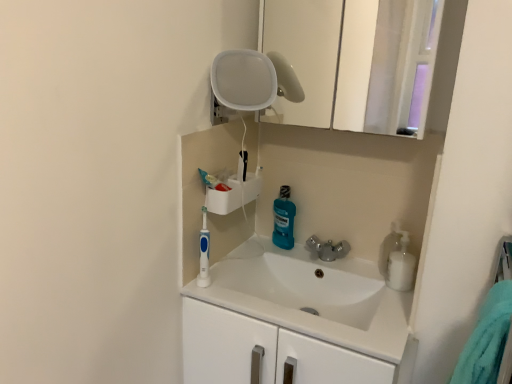
What is the approximate height of blue glossy mouthwash at center, which is the 2th cleaning product in front-to-back order?

It is 22.59 centimeters.

What do you see at coordinates (401, 265) in the screenshot? I see `white glossy bottle at right, the 1th cleaning product from the right` at bounding box center [401, 265].

What do you see at coordinates (313, 297) in the screenshot? This screenshot has height=384, width=512. I see `white glossy sink at center` at bounding box center [313, 297].

Locate an element on the screen. blue glossy mouthwash at center, acting as the 1th cleaning product starting from the back is located at coordinates (284, 219).

Considering the relative positions of white glossy medicine cabinet at upper center and blue glossy mouthwash at center, which is the 2th cleaning product in front-to-back order, in the image provided, is white glossy medicine cabinet at upper center behind blue glossy mouthwash at center, which is the 2th cleaning product in front-to-back order,?

No, the depth of white glossy medicine cabinet at upper center is less than that of blue glossy mouthwash at center, which is the 2th cleaning product in front-to-back order.

Does white glossy medicine cabinet at upper center turn towards blue glossy mouthwash at center, positioned as the second cleaning product in right-to-left order?

No, white glossy medicine cabinet at upper center is not aimed at blue glossy mouthwash at center, positioned as the second cleaning product in right-to-left order.

Looking at this image, is blue glossy mouthwash at center, which is the 2th cleaning product in front-to-back order, completely or partially inside white glossy medicine cabinet at upper center?

No, blue glossy mouthwash at center, which is the 2th cleaning product in front-to-back order, is not surrounded by white glossy medicine cabinet at upper center.

Considering the sizes of teal soft towel at right and blue glossy mouthwash at center, positioned as the second cleaning product in right-to-left order, in the image, is teal soft towel at right bigger or smaller than blue glossy mouthwash at center, positioned as the second cleaning product in right-to-left order,?

teal soft towel at right is bigger than blue glossy mouthwash at center, positioned as the second cleaning product in right-to-left order.

Based on the photo, from a real-world perspective, does teal soft towel at right sit lower than blue glossy mouthwash at center, marked as the 1th cleaning product in a left-to-right arrangement?

Actually, teal soft towel at right is physically above blue glossy mouthwash at center, marked as the 1th cleaning product in a left-to-right arrangement, in the real world.

Is teal soft towel at right facing away from blue glossy mouthwash at center, acting as the 1th cleaning product starting from the back?

No, teal soft towel at right's orientation is not away from blue glossy mouthwash at center, acting as the 1th cleaning product starting from the back.

Looking at this image, is teal soft towel at right in front of or behind blue glossy mouthwash at center, acting as the 1th cleaning product starting from the back, in the image?

Clearly, teal soft towel at right is in front of blue glossy mouthwash at center, acting as the 1th cleaning product starting from the back.

From a real-world perspective, is teal soft towel at right located beneath white glossy sink at center?

No, from a real-world perspective, teal soft towel at right is not under white glossy sink at center.

How much distance is there between teal soft towel at right and white glossy sink at center?

teal soft towel at right is 22.76 inches from white glossy sink at center.

Is point (488, 297) in front of point (334, 289)?

Yes, point (488, 297) is closer to viewer.

In the scene shown: Choose the correct answer: Is teal soft towel at right inside white glossy sink at center or outside it?

teal soft towel at right is located beyond the bounds of white glossy sink at center.

Looking at this image, is white glossy bottle at right, the 1th cleaning product from the right, outside of blue plastic toothbrush at center-left?

→ white glossy bottle at right, the 1th cleaning product from the right, lies outside blue plastic toothbrush at center-left's area.

Does white glossy bottle at right, which is the second cleaning product in back-to-front order, have a lesser height compared to blue plastic toothbrush at center-left?

Indeed, white glossy bottle at right, which is the second cleaning product in back-to-front order, has a lesser height compared to blue plastic toothbrush at center-left.

Is white glossy bottle at right, the 1th cleaning product positioned from the front, facing towards blue plastic toothbrush at center-left?

No, white glossy bottle at right, the 1th cleaning product positioned from the front, is not turned towards blue plastic toothbrush at center-left.

Can you see white glossy bottle at right, the 1th cleaning product positioned from the front, touching blue plastic toothbrush at center-left?

Answer: They are not placed beside each other.

From a real-world perspective, is white glossy medicine cabinet at upper center above or below blue plastic toothbrush at center-left?

In terms of real-world spatial position, white glossy medicine cabinet at upper center is above blue plastic toothbrush at center-left.

Which is behind, point (398, 43) or point (203, 227)?

Positioned behind is point (398, 43).

Can you confirm if white glossy medicine cabinet at upper center is taller than blue plastic toothbrush at center-left?

Yes, white glossy medicine cabinet at upper center is taller than blue plastic toothbrush at center-left.

Does white glossy medicine cabinet at upper center turn towards blue plastic toothbrush at center-left?

No.

Considering the relative sizes of white glossy medicine cabinet at upper center and white glossy bottle at right, which is the second cleaning product in back-to-front order, in the image provided, is white glossy medicine cabinet at upper center bigger than white glossy bottle at right, which is the second cleaning product in back-to-front order,?

Indeed, white glossy medicine cabinet at upper center has a larger size compared to white glossy bottle at right, which is the second cleaning product in back-to-front order.

From a real-world perspective, between white glossy medicine cabinet at upper center and white glossy bottle at right, the 2th cleaning product positioned from the left, who is vertically higher?

white glossy medicine cabinet at upper center, from a real-world perspective.

Considering the relative sizes of white glossy medicine cabinet at upper center and white glossy bottle at right, the 1th cleaning product positioned from the front, in the image provided, is white glossy medicine cabinet at upper center shorter than white glossy bottle at right, the 1th cleaning product positioned from the front,?

In fact, white glossy medicine cabinet at upper center may be taller than white glossy bottle at right, the 1th cleaning product positioned from the front.

Is blue plastic toothbrush at center-left outside of white glossy medicine cabinet at upper center?

That's correct, blue plastic toothbrush at center-left is outside of white glossy medicine cabinet at upper center.

Considering the relative positions of blue plastic toothbrush at center-left and white glossy medicine cabinet at upper center in the image provided, is blue plastic toothbrush at center-left to the left of white glossy medicine cabinet at upper center from the viewer's perspective?

Indeed, blue plastic toothbrush at center-left is positioned on the left side of white glossy medicine cabinet at upper center.

In terms of height, does blue plastic toothbrush at center-left look taller or shorter compared to white glossy medicine cabinet at upper center?

Clearly, blue plastic toothbrush at center-left is shorter compared to white glossy medicine cabinet at upper center.

Which object is further away from the camera taking this photo, blue plastic toothbrush at center-left or white glossy medicine cabinet at upper center?

blue plastic toothbrush at center-left is behind.

There is a white glossy medicine cabinet at upper center. At what (x,y) coordinates should I click in order to perform the action: click on the 1st cleaning product below it (from a real-world perspective). Please return your answer as a coordinate pair (x, y). This screenshot has height=384, width=512. Looking at the image, I should click on (284, 219).

Identify the location of bath towel that appears below the blue glossy mouthwash at center, positioned as the second cleaning product in right-to-left order (from the image's perspective). [x=486, y=339].

When comparing their distances from white glossy bottle at right, the 1th cleaning product from the right, does white glossy sink at center or teal soft towel at right seem closer?

white glossy sink at center is positioned closer to the anchor white glossy bottle at right, the 1th cleaning product from the right.

When comparing their distances from teal soft towel at right, does blue glossy mouthwash at center, which is the 2th cleaning product in front-to-back order, or white glossy sink at center seem further?

Among the two, blue glossy mouthwash at center, which is the 2th cleaning product in front-to-back order, is located further to teal soft towel at right.

Based on their spatial positions, is white glossy medicine cabinet at upper center or white glossy sink at center closer to blue plastic toothbrush at center-left?

white glossy sink at center is closer to blue plastic toothbrush at center-left.

When comparing their distances from blue plastic toothbrush at center-left, does blue glossy mouthwash at center, marked as the 1th cleaning product in a left-to-right arrangement, or white glossy bottle at right, which is the second cleaning product in back-to-front order, seem closer?

The object closer to blue plastic toothbrush at center-left is blue glossy mouthwash at center, marked as the 1th cleaning product in a left-to-right arrangement.

Looking at the image, which one is located closer to blue plastic toothbrush at center-left, teal soft towel at right or white glossy sink at center?

white glossy sink at center lies closer to blue plastic toothbrush at center-left than the other object.

When comparing their distances from teal soft towel at right, does blue plastic toothbrush at center-left or white glossy bottle at right, which is the second cleaning product in back-to-front order, seem closer?

white glossy bottle at right, which is the second cleaning product in back-to-front order.

Based on their spatial positions, is blue plastic toothbrush at center-left or white glossy bottle at right, the 1th cleaning product positioned from the front, closer to white glossy medicine cabinet at upper center?

white glossy bottle at right, the 1th cleaning product positioned from the front, lies closer to white glossy medicine cabinet at upper center than the other object.

Estimate the real-world distances between objects in this image. Which object is further from teal soft towel at right, white glossy sink at center or white glossy bottle at right, the 2th cleaning product positioned from the left?

white glossy sink at center.

You are a GUI agent. You are given a task and a screenshot of the screen. Output one action in this format:
    pyautogui.click(x=<x>, y=<y>)
    Task: Click on the toiletry between blue glossy mouthwash at center, marked as the 1th cleaning product in a left-to-right arrangement, and white glossy sink at center, in the vertical direction
    Image resolution: width=512 pixels, height=384 pixels.
    Given the screenshot: What is the action you would take?
    pyautogui.click(x=204, y=253)

Image resolution: width=512 pixels, height=384 pixels. What are the coordinates of `toiletry located between teal soft towel at right and blue glossy mouthwash at center, which is the 2th cleaning product in front-to-back order, in the depth direction` in the screenshot? It's located at (204, 253).

In order to click on toiletry between white glossy medicine cabinet at upper center and white glossy bottle at right, which is the second cleaning product in back-to-front order, in the up-down direction in this screenshot , I will do `click(204, 253)`.

At what (x,y) coordinates should I click in order to perform the action: click on cleaning product that lies between white glossy medicine cabinet at upper center and blue plastic toothbrush at center-left from top to bottom. Please return your answer as a coordinate pair (x, y). Image resolution: width=512 pixels, height=384 pixels. Looking at the image, I should click on (284, 219).